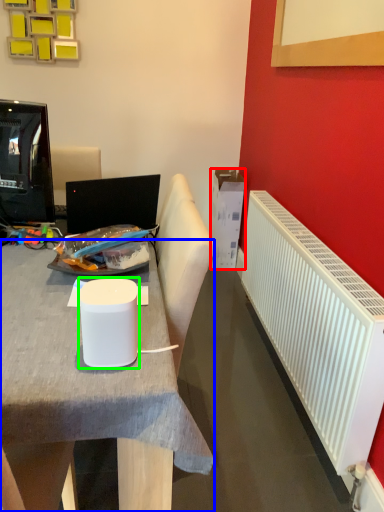
Question: Which object is positioned closest to box (highlighted by a red box)? Select from desk (highlighted by a blue box) and paper cup (highlighted by a green box).

Choices:
 (A) desk
 (B) paper cup

Answer: (A)